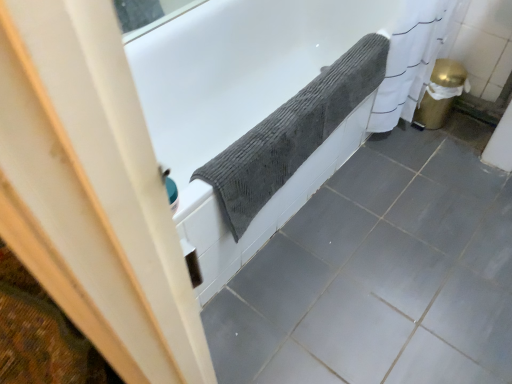
Where is `free space underneath gray matte ceramic tile at lower center, positioned as the 1th ceramic tile in top-to-bottom order (from a real-world perspective)`? free space underneath gray matte ceramic tile at lower center, positioned as the 1th ceramic tile in top-to-bottom order (from a real-world perspective) is located at coordinates pyautogui.click(x=494, y=219).